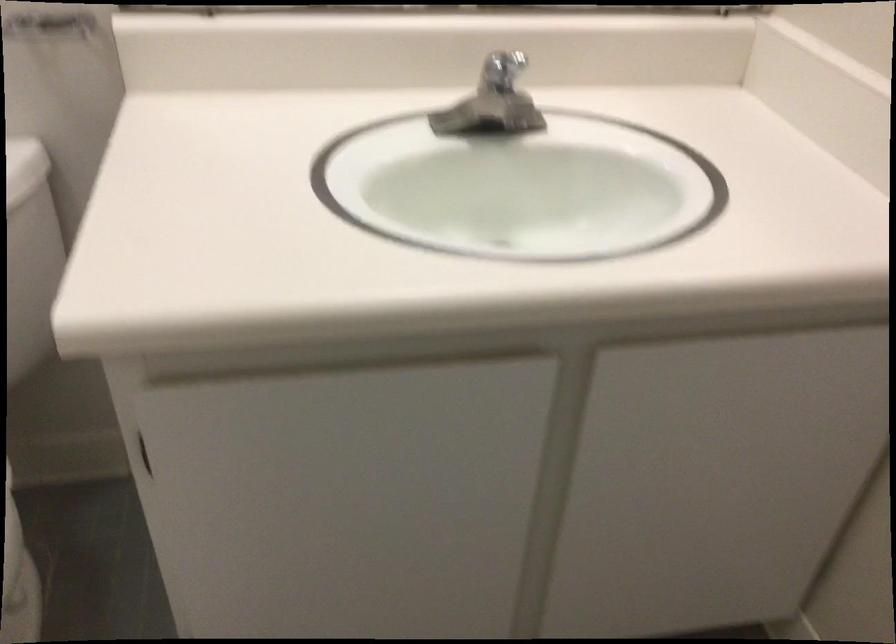
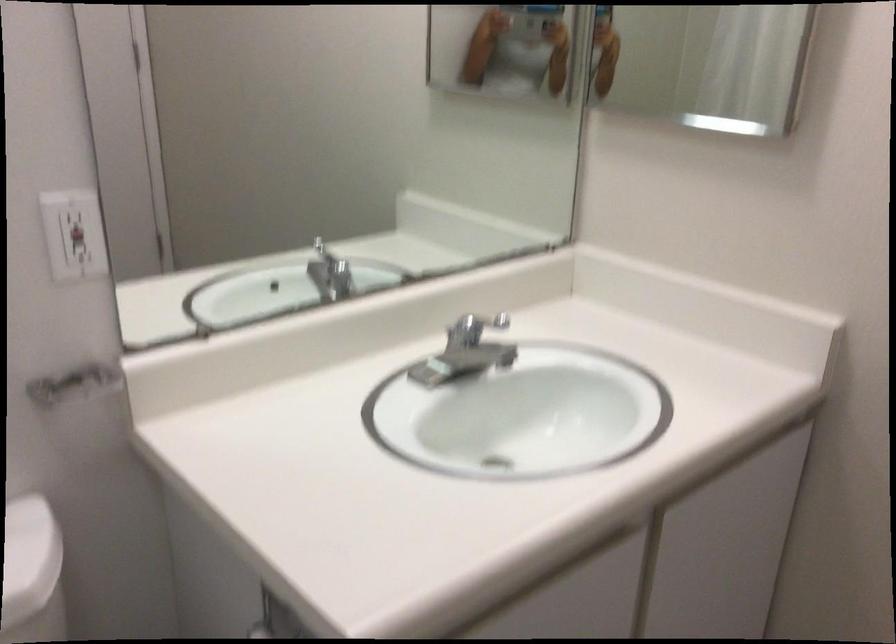
Question: I am providing you with two images of the same scene from different viewpoints. Please identify which objects are invisible in image2.

Choices:
 (A) sink stopper rod
 (B) medicine cabinet handle
 (C) red outlet button
 (D) none of these

Answer: (D)